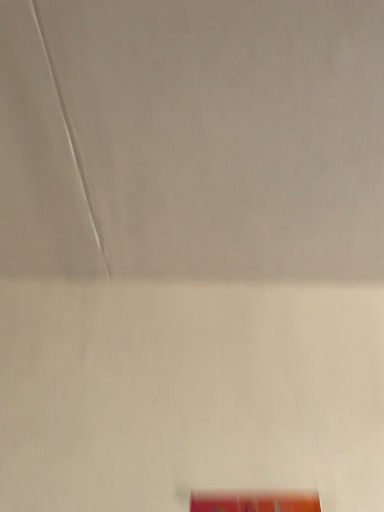
Where is `matte orange poster at lower right`? matte orange poster at lower right is located at coordinates (254, 502).

What do you see at coordinates (254, 502) in the screenshot? I see `matte orange poster at lower right` at bounding box center [254, 502].

Identify the location of matte orange poster at lower right. (254, 502).